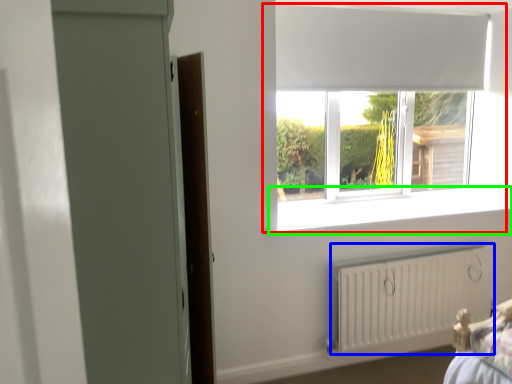
Question: Considering the real-world distances, which object is closest to window (highlighted by a red box)? radiator (highlighted by a blue box) or window sill (highlighted by a green box).

Choices:
 (A) radiator
 (B) window sill

Answer: (B)